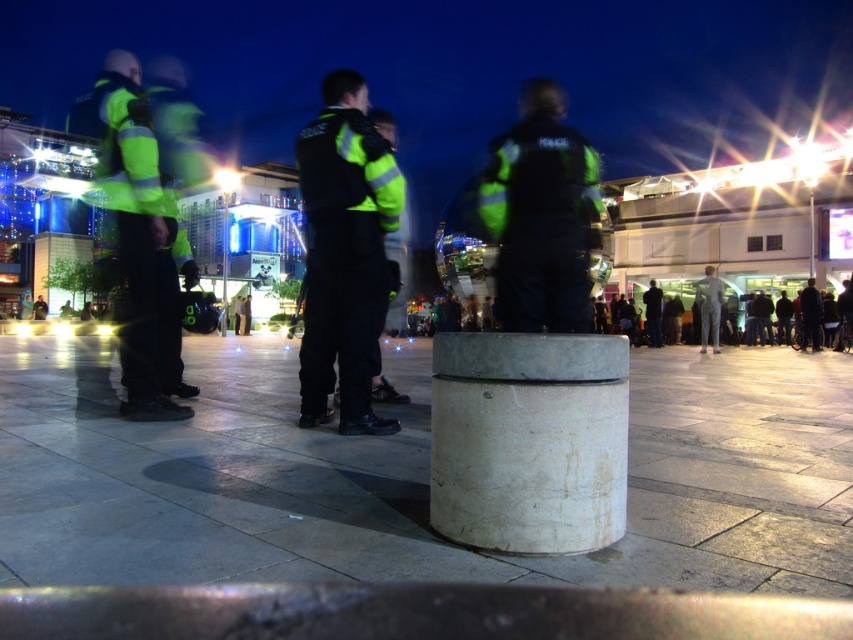
Between point (566, 208) and point (106, 180), which one is positioned in front?

Positioned in front is point (106, 180).

Where is `green reflective jacket at center`? Image resolution: width=853 pixels, height=640 pixels. green reflective jacket at center is located at coordinates (541, 214).

Is point (529, 284) in front of point (68, 129)?

Yes.

Where is `green reflective jacket at center`? The image size is (853, 640). green reflective jacket at center is located at coordinates (541, 214).

Based on the photo, does high-visibility reflective jacket at center have a greater height compared to high-visibility reflective jacket at left?

Incorrect, high-visibility reflective jacket at center's height is not larger of high-visibility reflective jacket at left's.

Does high-visibility reflective jacket at center appear over high-visibility reflective jacket at left?

Actually, high-visibility reflective jacket at center is below high-visibility reflective jacket at left.

Between point (390, 204) and point (128, 416), which one is positioned in front?

Point (390, 204) is in front.

This screenshot has width=853, height=640. I want to click on high-visibility reflective jacket at center, so click(344, 253).

Measure the distance between point (364, 188) and camera.

Point (364, 188) and camera are 4.92 meters apart.

Can you confirm if high-visibility reflective jacket at center is positioned below green reflective jacket at center?

Correct, high-visibility reflective jacket at center is located below green reflective jacket at center.

The width and height of the screenshot is (853, 640). Find the location of `high-visibility reflective jacket at center`. high-visibility reflective jacket at center is located at coordinates (344, 253).